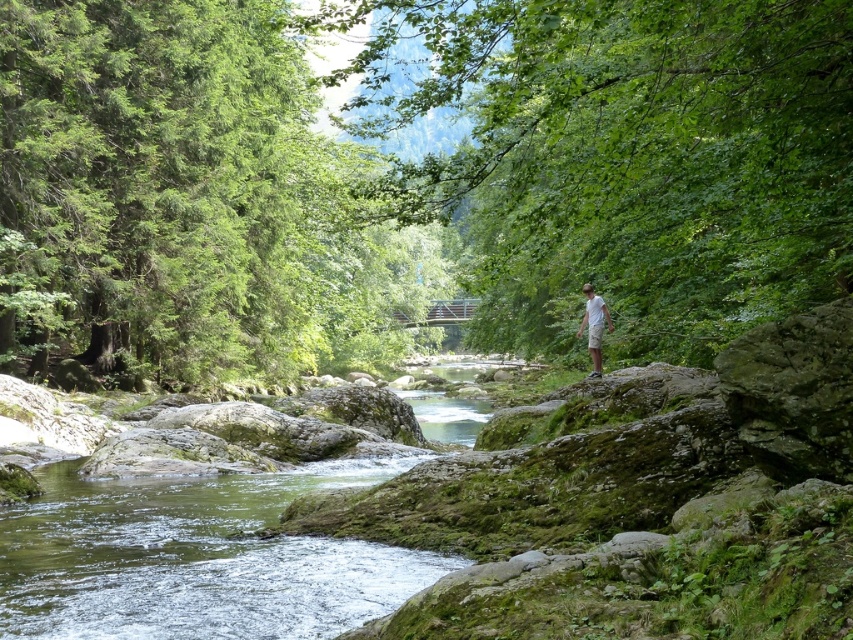
You are a hiker trying to cross the river using the green mossy water at center. To do so, you need to first navigate around the green leafy tree at center. Which direction should you move relative to the tree to reach the water?

Since the green mossy water at center is behind the green leafy tree at center, you should move behind the green leafy tree at center to reach the green mossy water at center.

You are standing at the point marked by the coordinates point [187,198] in the scene. What object are you directly facing?

The point [187,198] corresponds to the green leafy tree at upper left, so you are directly facing the green leafy tree at upper left.

You are standing at the origin point of the coordinate system. You want to reach the green leafy tree at center. Which direction should you move in terms of x and y coordinates?

You should move towards the positive x direction and positive y direction to reach the green leafy tree at center located at point (621, 156).